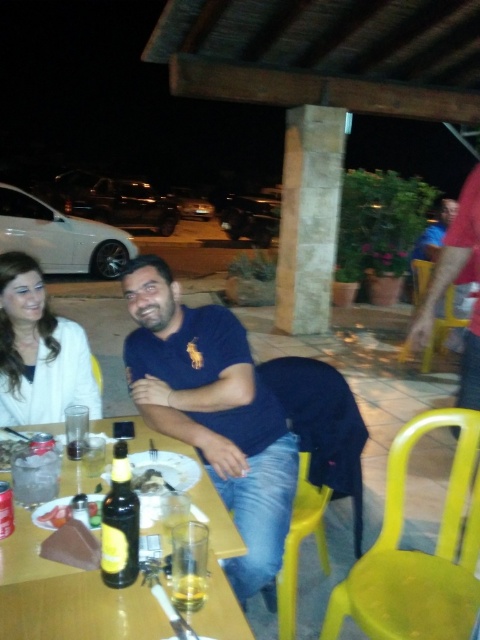
You are a guest at this outdoor dinner and want to place your phone on the table without blocking the view of the translucent glass at table center. Where should you place your phone relative to the white knit sweater at upper left?

Place your phone to the right of the white knit sweater at upper left, as the white knit sweater at upper left is taller than the translucent glass at table center and might block the view if placed in front of it.

You are a server at this outdoor dining area and need to place a new drink order on the table. The drink is 10 inches in diameter. Can you fit it between the translucent plastic container at table center and the translucent glass plate at table center without moving either item?

The distance between the translucent plastic container at table center and the translucent glass plate at table center is 10.35 inches. Since the drink is 10 inches in diameter, it can fit between them as the available space is slightly larger than the drink.